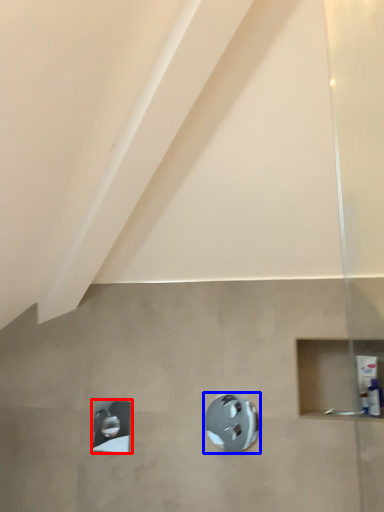
Question: Among these objects, which one is nearest to the camera, shower (highlighted by a red box) or shower (highlighted by a blue box)?

Choices:
 (A) shower
 (B) shower

Answer: (B)